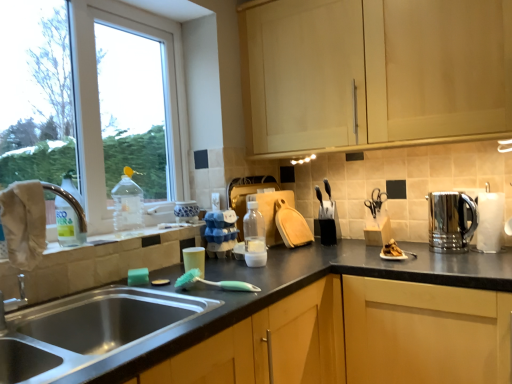
Question: Is polished stainless steel kettle at right, which is the first appliance in right-to-left order, taller or shorter than white paper towel at right?

Choices:
 (A) tall
 (B) short

Answer: (B)

Question: Visually, is polished stainless steel kettle at right, positioned as the third appliance in left-to-right order, positioned to the left or to the right of white paper towel at right?

Choices:
 (A) left
 (B) right

Answer: (A)

Question: Which object is positioned farthest from the green rubber brush at sink?

Choices:
 (A) translucent plastic bottle at center, the 1th bottle viewed from the right
 (B) translucent plastic cup at sink
 (C) beige fabric at sink left
 (D) stainless steel sink at lower left
 (E) yellow matte window sill at lower left

Answer: (C)

Question: Estimate the real-world distances between objects in this image. Which object is farther from the green rubber brush at sink?

Choices:
 (A) white paper towel at right
 (B) translucent plastic bottle at left, placed as the 3th bottle when sorted from right to left
 (C) translucent plastic bottle at center, the 1th bottle viewed from the right
 (D) stainless steel sink at lower left
 (E) yellow matte window sill at lower left

Answer: (A)